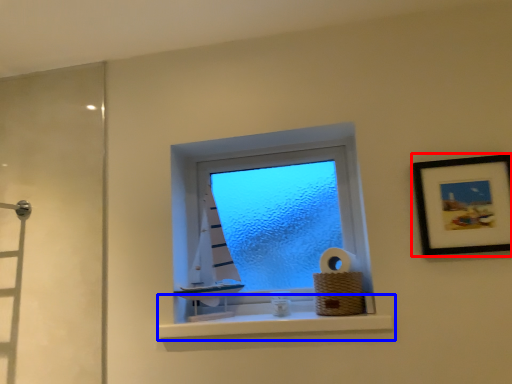
Question: Which of the following is the closest to the observer, picture frame (highlighted by a red box) or window sill (highlighted by a blue box)?

Choices:
 (A) picture frame
 (B) window sill

Answer: (A)